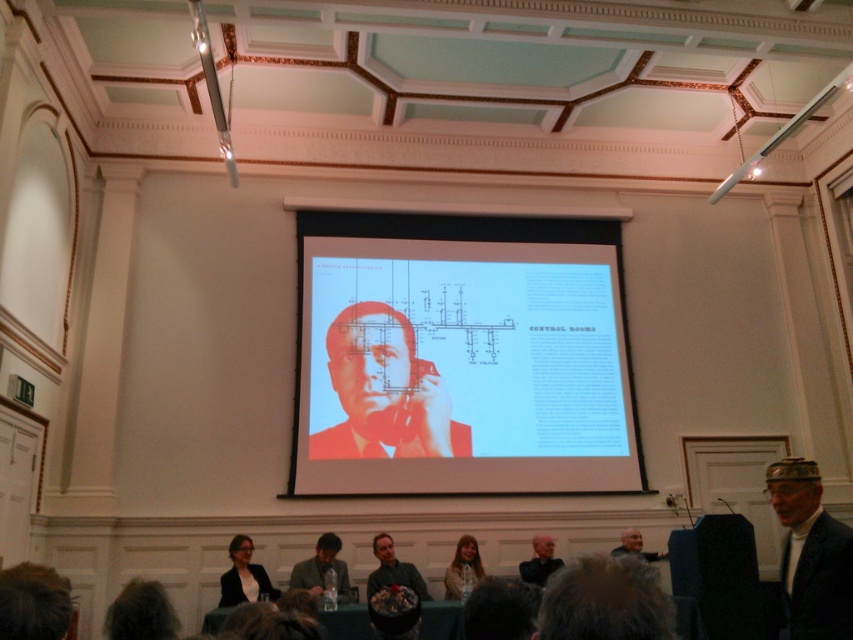
Question: Does dark blue fabric at lower right have a greater width compared to gray fabric jacket at lower right?

Choices:
 (A) no
 (B) yes

Answer: (B)

Question: Is matte red suit at center below black fabric jacket at lower center?

Choices:
 (A) no
 (B) yes

Answer: (A)

Question: Which point appears farthest from the camera in this image?

Choices:
 (A) (363, 346)
 (B) (331, 550)

Answer: (A)

Question: Which point is farther to the camera?

Choices:
 (A) dark gray suit at lower center
 (B) matte red suit at center
 (C) dark blue fabric at lower right

Answer: (B)

Question: Which point is closer to the camera?

Choices:
 (A) (819, 561)
 (B) (548, 568)
 (C) (236, 540)
 (D) (318, 552)

Answer: (A)

Question: Is dark blue fabric at lower right in front of dark gray suit at lower center?

Choices:
 (A) yes
 (B) no

Answer: (A)